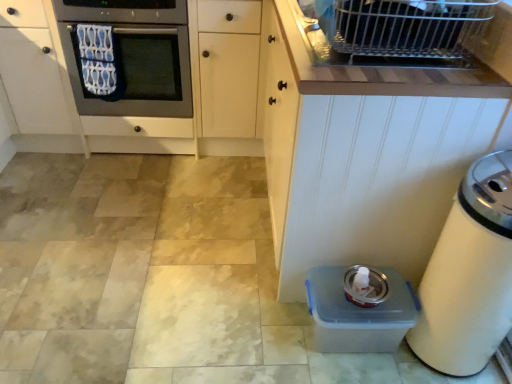
The height and width of the screenshot is (384, 512). What do you see at coordinates (369, 149) in the screenshot?
I see `white wood cabinet at lower right` at bounding box center [369, 149].

What do you see at coordinates (469, 274) in the screenshot? The image size is (512, 384). I see `white plastic trash can at lower right` at bounding box center [469, 274].

At what (x,y) coordinates should I click in order to perform the action: click on white wood cabinet at lower right. Please return your answer as a coordinate pair (x, y). Looking at the image, I should click on (369, 149).

Considering the relative positions of white plastic trash can at lower right and clear plastic container at lower right in the image provided, is white plastic trash can at lower right behind clear plastic container at lower right?

No, white plastic trash can at lower right is closer to the viewer.

Based on the photo, from a real-world perspective, which object stands above the other?

white plastic trash can at lower right.

How much distance is there between white plastic trash can at lower right and clear plastic container at lower right?

The distance of white plastic trash can at lower right from clear plastic container at lower right is 9.18 inches.

Is white plastic trash can at lower right spatially inside clear plastic container at lower right, or outside of it?

white plastic trash can at lower right is not inside clear plastic container at lower right, it's outside.

Considering the relative positions of white plastic trash can at lower right and metallic gray oven at left in the image provided, is white plastic trash can at lower right to the left or to the right of metallic gray oven at left?

Based on their positions, white plastic trash can at lower right is located to the right of metallic gray oven at left.

Relative to metallic gray oven at left, is white plastic trash can at lower right in front or behind?

Clearly, white plastic trash can at lower right is in front of metallic gray oven at left.

Between white plastic trash can at lower right and metallic gray oven at left, which one has larger size?

metallic gray oven at left is bigger.

Considering the sizes of objects metallic gray oven at left and clear plastic container at lower right in the image provided, who is taller, metallic gray oven at left or clear plastic container at lower right?

metallic gray oven at left is taller.

From a real-world perspective, which object rests below the other?

From a 3D spatial view, clear plastic container at lower right is below.

In the image, is metallic gray oven at left positioned in front of or behind clear plastic container at lower right?

Clearly, metallic gray oven at left is behind clear plastic container at lower right.

Are metallic gray oven at left and clear plastic container at lower right beside each other?

No, metallic gray oven at left is not in contact with clear plastic container at lower right.

Looking at this image, is white wood cabinet at lower right inside or outside of metallic gray oven at left?

white wood cabinet at lower right lies outside metallic gray oven at left.

Does white wood cabinet at lower right have a greater height compared to metallic gray oven at left?

Indeed, white wood cabinet at lower right has a greater height compared to metallic gray oven at left.

Which object is further away from the camera, white wood cabinet at lower right or metallic gray oven at left?

metallic gray oven at left is further from the camera.

Image resolution: width=512 pixels, height=384 pixels. What are the coordinates of `cabinetry located behind the white plastic trash can at lower right` in the screenshot? It's located at (369, 149).

Could white plastic trash can at lower right be considered to be inside white wood cabinet at lower right?

No, white plastic trash can at lower right is located outside of white wood cabinet at lower right.

Can you confirm if white wood cabinet at lower right is smaller than white plastic trash can at lower right?

No.

From a real-world perspective, between clear plastic container at lower right and white wood cabinet at lower right, who is vertically lower?

In real-world perspective, clear plastic container at lower right is lower.

Based on the photo, is clear plastic container at lower right taller or shorter than white wood cabinet at lower right?

Clearly, clear plastic container at lower right is shorter compared to white wood cabinet at lower right.

Consider the image. Is clear plastic container at lower right further to camera compared to white wood cabinet at lower right?

Yes, it is.

Could white wood cabinet at lower right be considered to be inside clear plastic container at lower right?

No, white wood cabinet at lower right is not a part of clear plastic container at lower right.

From a real-world perspective, is clear plastic container at lower right under metallic gray oven at left?

Yes, from a real-world perspective, clear plastic container at lower right is below metallic gray oven at left.

From the picture: Are clear plastic container at lower right and metallic gray oven at left making contact?

clear plastic container at lower right and metallic gray oven at left are clearly separated.

Is point (344, 346) behind point (157, 14)?

That is False.

From the image's perspective, is clear plastic container at lower right under metallic gray oven at left?

Yes, from the image's perspective, clear plastic container at lower right is below metallic gray oven at left.

Find the location of a particular element. This screenshot has height=384, width=512. water cooler on the left of the white plastic trash can at lower right is located at coordinates (360, 309).

Locate an element on the screen. This screenshot has height=384, width=512. home appliance that appears below the metallic gray oven at left (from a real-world perspective) is located at coordinates (469, 274).

When comparing their distances from clear plastic container at lower right, does white plastic trash can at lower right or metallic gray oven at left seem further?

metallic gray oven at left lies further to clear plastic container at lower right than the other object.

When comparing their distances from white plastic trash can at lower right, does white wood cabinet at lower right or clear plastic container at lower right seem further?

white wood cabinet at lower right.

From the picture: Based on their spatial positions, is white wood cabinet at lower right or metallic gray oven at left further from clear plastic container at lower right?

The object further to clear plastic container at lower right is metallic gray oven at left.

Estimate the real-world distances between objects in this image. Which object is further from metallic gray oven at left, clear plastic container at lower right or white wood cabinet at lower right?

clear plastic container at lower right lies further to metallic gray oven at left than the other object.

From the image, which object appears to be farther from metallic gray oven at left, white wood cabinet at lower right or clear plastic container at lower right?

clear plastic container at lower right.

Looking at the image, which one is located further to white plastic trash can at lower right, clear plastic container at lower right or metallic gray oven at left?

metallic gray oven at left is positioned further to the anchor white plastic trash can at lower right.

When comparing their distances from white plastic trash can at lower right, does metallic gray oven at left or clear plastic container at lower right seem further?

The object further to white plastic trash can at lower right is metallic gray oven at left.

Which object lies nearer to the anchor point metallic gray oven at left, white wood cabinet at lower right or white plastic trash can at lower right?

white wood cabinet at lower right lies closer to metallic gray oven at left than the other object.

Locate an element on the screen. The image size is (512, 384). water cooler located between metallic gray oven at left and white plastic trash can at lower right in the left-right direction is located at coordinates (360, 309).

Find the location of a particular element. home appliance between white wood cabinet at lower right and clear plastic container at lower right vertically is located at coordinates (469, 274).

Where is `cabinetry between metallic gray oven at left and white plastic trash can at lower right from left to right`? The width and height of the screenshot is (512, 384). cabinetry between metallic gray oven at left and white plastic trash can at lower right from left to right is located at coordinates (369, 149).

Identify the location of cabinetry between metallic gray oven at left and clear plastic container at lower right in the up-down direction. (369, 149).